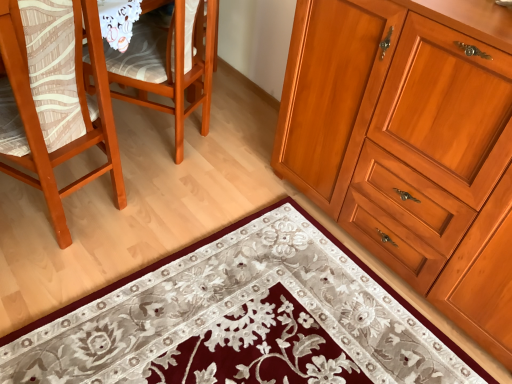
At what (x,y) coordinates should I click in order to perform the action: click on floral carpet at lower center. Please return your answer as a coordinate pair (x, y). Looking at the image, I should click on (242, 319).

The image size is (512, 384). What do you see at coordinates (39, 106) in the screenshot?
I see `matte wood chair at left, arranged as the 1th chair when viewed from the left` at bounding box center [39, 106].

This screenshot has height=384, width=512. Identify the location of wooden chair at left, placed as the 2th chair when sorted from left to right. (170, 63).

Find the location of `floral carpet at lower center`. floral carpet at lower center is located at coordinates (242, 319).

What's the angular difference between wooden chair at left, placed as the 2th chair when sorted from left to right, and matte wood chair at left, arranged as the 1th chair when viewed from the left,'s facing directions?

wooden chair at left, placed as the 2th chair when sorted from left to right, and matte wood chair at left, arranged as the 1th chair when viewed from the left, are facing 12 degrees away from each other.

Is wooden chair at left, placed as the 2th chair when sorted from left to right, oriented away from matte wood chair at left, the second chair when ordered from right to left?

That's not correct — wooden chair at left, placed as the 2th chair when sorted from left to right, is not looking away from matte wood chair at left, the second chair when ordered from right to left.

Is matte wood chair at left, the second chair when ordered from right to left, a part of wooden chair at left, placed as the 2th chair when sorted from left to right?

That's incorrect, matte wood chair at left, the second chair when ordered from right to left, is not inside wooden chair at left, placed as the 2th chair when sorted from left to right.

Can you confirm if wooden chair at left, placed as the 2th chair when sorted from left to right, is shorter than matte wood chair at left, arranged as the 1th chair when viewed from the left?

Yes, wooden chair at left, placed as the 2th chair when sorted from left to right, is shorter than matte wood chair at left, arranged as the 1th chair when viewed from the left.

Does matte wood chair at left, arranged as the 1th chair when viewed from the left, have a greater height compared to floral carpet at lower center?

Indeed, matte wood chair at left, arranged as the 1th chair when viewed from the left, has a greater height compared to floral carpet at lower center.

From the image's perspective, is matte wood chair at left, arranged as the 1th chair when viewed from the left, above or below floral carpet at lower center?

From the image's perspective, matte wood chair at left, arranged as the 1th chair when viewed from the left, appears above floral carpet at lower center.

Between matte wood chair at left, arranged as the 1th chair when viewed from the left, and floral carpet at lower center, which one appears on the right side from the viewer's perspective?

From the viewer's perspective, floral carpet at lower center appears more on the right side.

Which of these two, matte wood chair at left, arranged as the 1th chair when viewed from the left, or floral carpet at lower center, is smaller?

floral carpet at lower center is smaller.

From a real-world perspective, is wooden cabinet at right beneath wooden chair at left, placed as the 2th chair when sorted from left to right?

No, from a real-world perspective, wooden cabinet at right is not below wooden chair at left, placed as the 2th chair when sorted from left to right.

Can you tell me how much wooden cabinet at right and wooden chair at left, placed as the 2th chair when sorted from left to right, differ in facing direction?

61.6 degrees.

You are a GUI agent. You are given a task and a screenshot of the screen. Output one action in this format:
    pyautogui.click(x=<x>, y=<y>)
    Task: Click on the cabinetry in front of the wooden chair at left, placed as the 2th chair when sorted from left to right
    The height and width of the screenshot is (384, 512).
    Given the screenshot: What is the action you would take?
    pyautogui.click(x=408, y=148)

Is wooden cabinet at right in contact with wooden chair at left, the 1th chair viewed from the right?

No.

Does wooden chair at left, placed as the 2th chair when sorted from left to right, have a lesser height compared to floral carpet at lower center?

No.

In terms of size, does wooden chair at left, placed as the 2th chair when sorted from left to right, appear bigger or smaller than floral carpet at lower center?

Considering their sizes, wooden chair at left, placed as the 2th chair when sorted from left to right, takes up more space than floral carpet at lower center.

From the image's perspective, is wooden chair at left, the 1th chair viewed from the right, located above floral carpet at lower center?

Yes, from the image's perspective, wooden chair at left, the 1th chair viewed from the right, is on top of floral carpet at lower center.

In terms of width, does wooden chair at left, the 1th chair viewed from the right, look wider or thinner when compared to floral carpet at lower center?

Clearly, wooden chair at left, the 1th chair viewed from the right, has less width compared to floral carpet at lower center.

From a real-world perspective, between floral carpet at lower center and matte wood chair at left, the second chair when ordered from right to left, who is vertically lower?

From a 3D spatial view, floral carpet at lower center is below.

Which is closer to the camera, (455, 361) or (21, 62)?

Positioned in front is point (21, 62).

How different are the orientations of floral carpet at lower center and matte wood chair at left, the second chair when ordered from right to left, in degrees?

The facing directions of floral carpet at lower center and matte wood chair at left, the second chair when ordered from right to left, are 73.8 degrees apart.

Looking at this image, considering the relative sizes of floral carpet at lower center and matte wood chair at left, arranged as the 1th chair when viewed from the left, in the image provided, is floral carpet at lower center bigger than matte wood chair at left, arranged as the 1th chair when viewed from the left,?

Actually, floral carpet at lower center might be smaller than matte wood chair at left, arranged as the 1th chair when viewed from the left.

Which of these two, floral carpet at lower center or wooden cabinet at right, is thinner?

Thinner between the two is wooden cabinet at right.

You are a GUI agent. You are given a task and a screenshot of the screen. Output one action in this format:
    pyautogui.click(x=<x>, y=<y>)
    Task: Click on the cabinetry that is above the floral carpet at lower center (from a real-world perspective)
    The image size is (512, 384).
    Given the screenshot: What is the action you would take?
    pyautogui.click(x=408, y=148)

How different are the orientations of floral carpet at lower center and wooden cabinet at right in degrees?

0.234 degrees separate the facing orientations of floral carpet at lower center and wooden cabinet at right.

Consider the image. From the image's perspective, between floral carpet at lower center and wooden cabinet at right, which one is located above?

wooden cabinet at right is shown above in the image.

From the image's perspective, who appears lower, wooden chair at left, the 1th chair viewed from the right, or wooden cabinet at right?

wooden cabinet at right is shown below in the image.

Is wooden chair at left, placed as the 2th chair when sorted from left to right, outside of wooden cabinet at right?

Yes.

Is wooden chair at left, the 1th chair viewed from the right, looking in the opposite direction of wooden cabinet at right?

Yes, wooden chair at left, the 1th chair viewed from the right, is positioned with its back facing wooden cabinet at right.

From a real-world perspective, is wooden chair at left, the 1th chair viewed from the right, over wooden cabinet at right?

Incorrect, from a real-world perspective, wooden chair at left, the 1th chair viewed from the right, is lower than wooden cabinet at right.

Where is `chair below the wooden chair at left, the 1th chair viewed from the right (from the image's perspective)`? The width and height of the screenshot is (512, 384). chair below the wooden chair at left, the 1th chair viewed from the right (from the image's perspective) is located at coordinates (39, 106).

The width and height of the screenshot is (512, 384). What are the coordinates of `doormat that appears below the matte wood chair at left, the second chair when ordered from right to left (from a real-world perspective)` in the screenshot? It's located at (242, 319).

When comparing their distances from matte wood chair at left, arranged as the 1th chair when viewed from the left, does floral carpet at lower center or wooden cabinet at right seem closer?

Among the two, floral carpet at lower center is located nearer to matte wood chair at left, arranged as the 1th chair when viewed from the left.

Estimate the real-world distances between objects in this image. Which object is further from floral carpet at lower center, matte wood chair at left, the second chair when ordered from right to left, or wooden chair at left, the 1th chair viewed from the right?

The object further to floral carpet at lower center is wooden chair at left, the 1th chair viewed from the right.

Which object lies further to the anchor point wooden chair at left, placed as the 2th chair when sorted from left to right, matte wood chair at left, arranged as the 1th chair when viewed from the left, or floral carpet at lower center?

Among the two, floral carpet at lower center is located further to wooden chair at left, placed as the 2th chair when sorted from left to right.

Considering their positions, is matte wood chair at left, arranged as the 1th chair when viewed from the left, positioned closer to wooden cabinet at right than floral carpet at lower center?

Based on the image, floral carpet at lower center appears to be nearer to wooden cabinet at right.

Considering their positions, is wooden chair at left, placed as the 2th chair when sorted from left to right, positioned closer to wooden cabinet at right than floral carpet at lower center?

floral carpet at lower center lies closer to wooden cabinet at right than the other object.

From the image, which object appears to be farther from wooden cabinet at right, wooden chair at left, the 1th chair viewed from the right, or matte wood chair at left, arranged as the 1th chair when viewed from the left?

matte wood chair at left, arranged as the 1th chair when viewed from the left, is further to wooden cabinet at right.

Looking at the image, which one is located closer to floral carpet at lower center, wooden chair at left, the 1th chair viewed from the right, or wooden cabinet at right?

Among the two, wooden cabinet at right is located nearer to floral carpet at lower center.

From the image, which object appears to be farther from floral carpet at lower center, wooden chair at left, placed as the 2th chair when sorted from left to right, or matte wood chair at left, arranged as the 1th chair when viewed from the left?

wooden chair at left, placed as the 2th chair when sorted from left to right.

The image size is (512, 384). I want to click on doormat between matte wood chair at left, the second chair when ordered from right to left, and wooden cabinet at right from left to right, so click(x=242, y=319).

You are a GUI agent. You are given a task and a screenshot of the screen. Output one action in this format:
    pyautogui.click(x=<x>, y=<y>)
    Task: Click on the chair between matte wood chair at left, the second chair when ordered from right to left, and wooden cabinet at right, in the horizontal direction
    
    Given the screenshot: What is the action you would take?
    pyautogui.click(x=170, y=63)

The width and height of the screenshot is (512, 384). What are the coordinates of `cabinetry between wooden chair at left, placed as the 2th chair when sorted from left to right, and floral carpet at lower center vertically` in the screenshot? It's located at (408, 148).

Locate an element on the screen. chair that lies between wooden chair at left, placed as the 2th chair when sorted from left to right, and floral carpet at lower center from top to bottom is located at coordinates (39, 106).